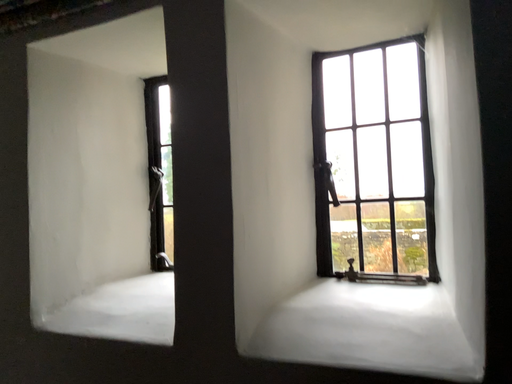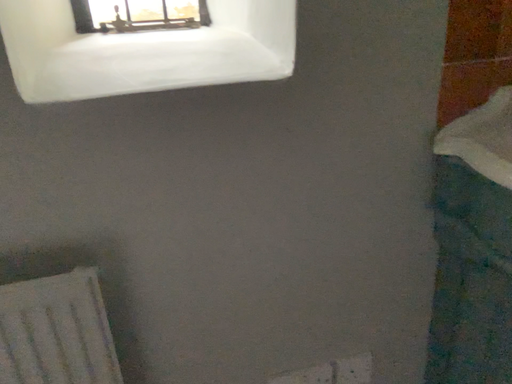
Question: How did the camera likely rotate when shooting the video?

Choices:
 (A) rotated upward
 (B) rotated downward

Answer: (B)